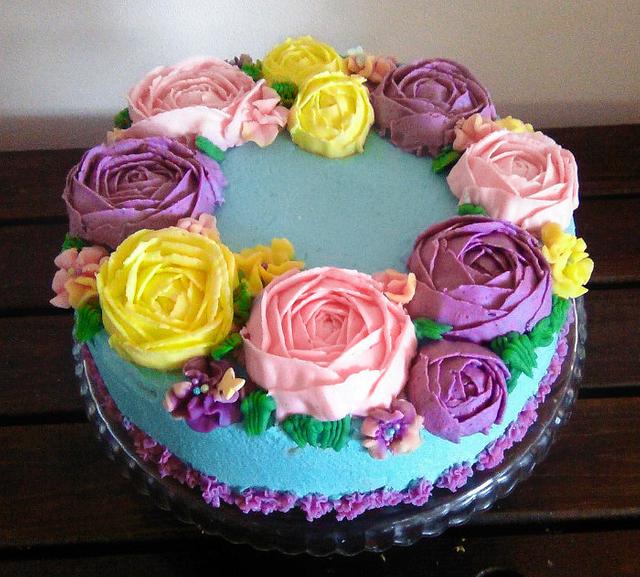
Where is `cake stand`? This screenshot has width=640, height=577. cake stand is located at coordinates pyautogui.click(x=454, y=511).